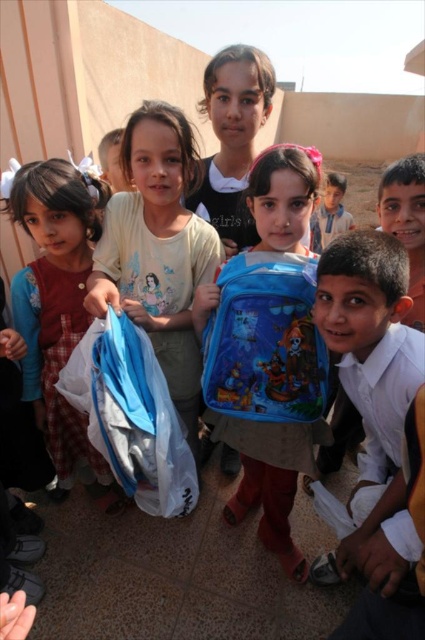
Question: Which of the following is the farthest from the observer?

Choices:
 (A) (138, 497)
 (B) (353, 221)
 (C) (424, 282)
 (D) (294, 164)

Answer: (B)

Question: Which object is the closest to the translucent plastic bag at lower left?

Choices:
 (A) light brown hair at upper center
 (B) blue fabric backpack at center
 (C) smooth brown hair at center
 (D) matte red dress at left

Answer: (B)

Question: Estimate the real-world distances between objects in this image. Which object is closer to the translucent plastic bag at lower left?

Choices:
 (A) smooth brown hair at center
 (B) cartoon-patterned backpack at center
 (C) white matte plastic bag at center
 (D) blue fabric backpack at center

Answer: (D)

Question: Is white matte plastic bag at center positioned in front of light brown hair at upper center?

Choices:
 (A) yes
 (B) no

Answer: (A)

Question: Is matte red dress at left to the right of translucent plastic bag at lower left from the viewer's perspective?

Choices:
 (A) yes
 (B) no

Answer: (B)

Question: Where is white matte plastic bag at center located in relation to matte red dress at left in the image?

Choices:
 (A) below
 (B) above

Answer: (B)